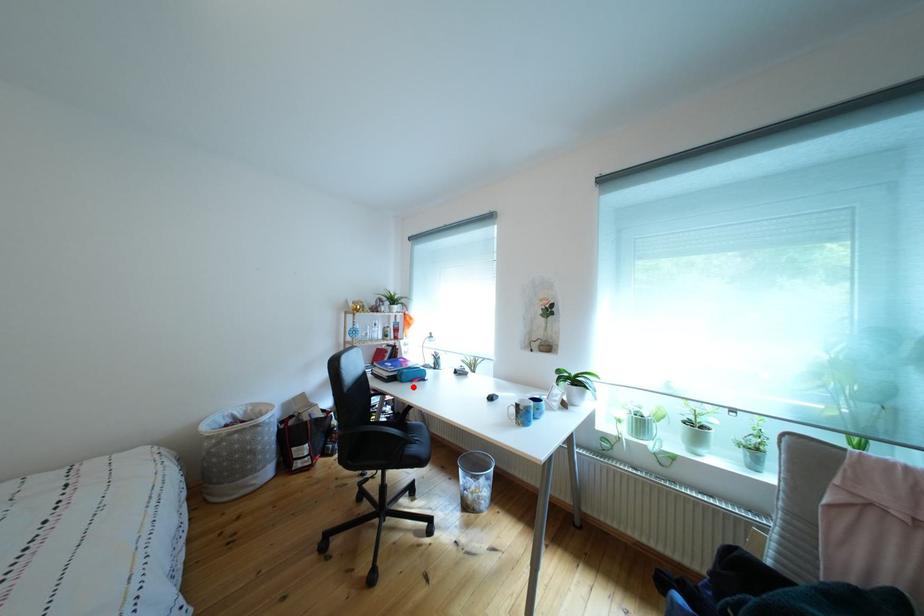
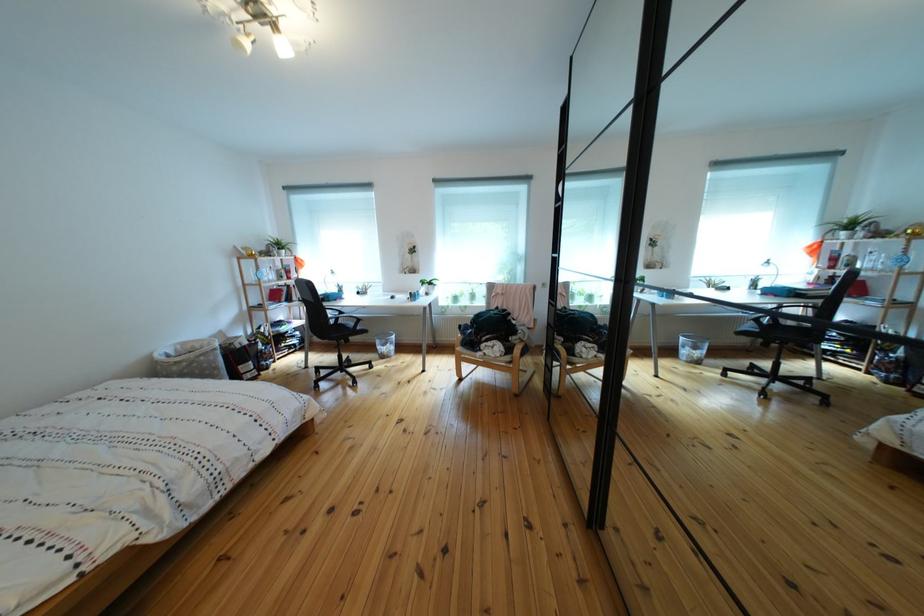
Where in the second image is the point corresponding to the highlighted location from the first image?

(341, 307)